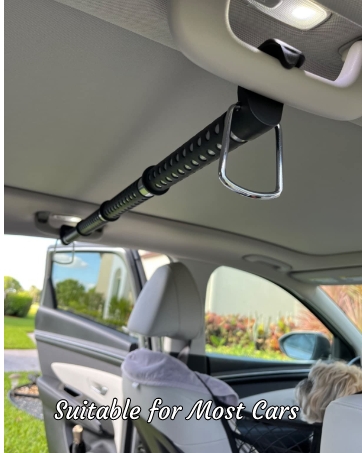
Find the location of a particular element. Image resolution: width=362 pixels, height=453 pixels. window is located at coordinates (250, 318).